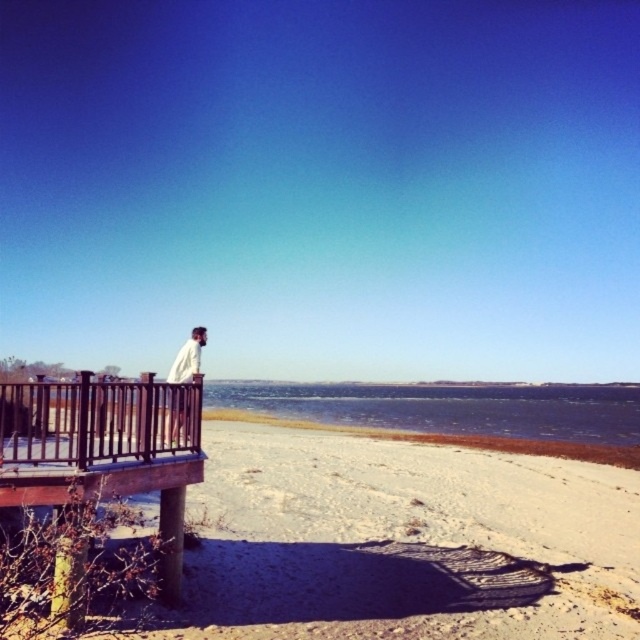
Question: Estimate the real-world distances between objects in this image. Which object is farther from the brown wooden balustrade at left?

Choices:
 (A) white sandy beach at lower left
 (B) white matte jacket at upper left

Answer: (A)

Question: Does white sandy beach at lower left appear on the right side of white matte jacket at upper left?

Choices:
 (A) no
 (B) yes

Answer: (B)

Question: Which object is positioned closest to the white matte jacket at upper left?

Choices:
 (A) brown wooden balustrade at left
 (B) white sandy beach at lower left

Answer: (B)

Question: Can you confirm if white sandy beach at lower left is smaller than brown wooden balustrade at left?

Choices:
 (A) yes
 (B) no

Answer: (B)

Question: Can you confirm if brown wooden balustrade at left is positioned to the left of white matte jacket at upper left?

Choices:
 (A) yes
 (B) no

Answer: (B)

Question: Which point is farther to the camera?

Choices:
 (A) tap(163, 540)
 (B) tap(218, 429)
 (C) tap(180, 388)

Answer: (B)